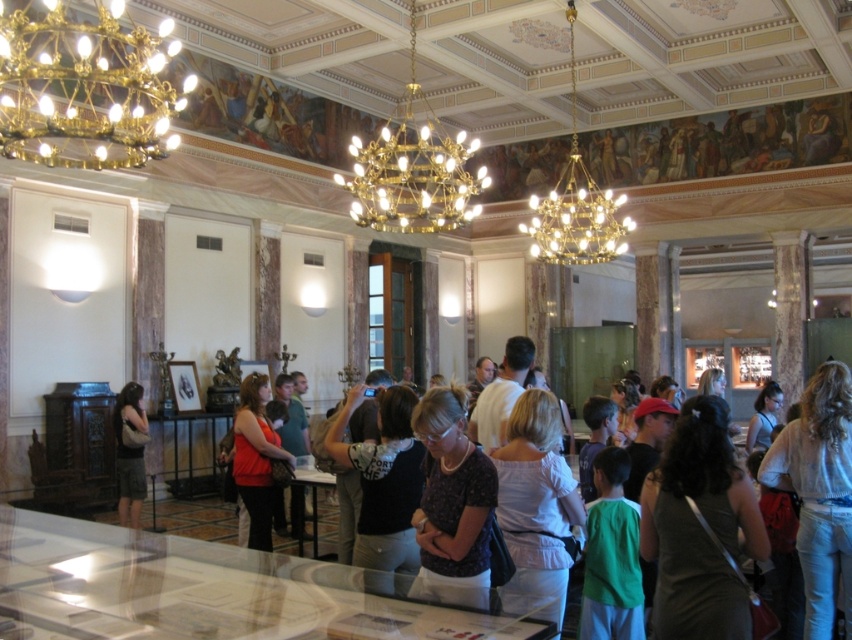
Question: Is dark gray fabric dress at center positioned before dark gray shirt at center?

Choices:
 (A) yes
 (B) no

Answer: (A)

Question: Which is nearer to the matte red blouse at center?

Choices:
 (A) dark purple shirt at center
 (B) dark gray fabric dress at center
 (C) dark gray shirt at center
 (D) dark brown hair at center

Answer: (C)

Question: Which of the following is the closest to the observer?

Choices:
 (A) white satin blouse at center
 (B) gold metallic chandelier at upper left
 (C) dark brown hair at center
 (D) matte red blouse at center

Answer: (A)

Question: Which object appears farthest from the camera in this image?

Choices:
 (A) dark gray fabric dress at center
 (B) gold metallic chandelier at upper left

Answer: (B)

Question: Can you confirm if dark purple shirt at center is smaller than matte gray dress at left?

Choices:
 (A) no
 (B) yes

Answer: (B)

Question: Does dark purple shirt at center appear over gold metallic chandelier at upper center?

Choices:
 (A) yes
 (B) no

Answer: (B)